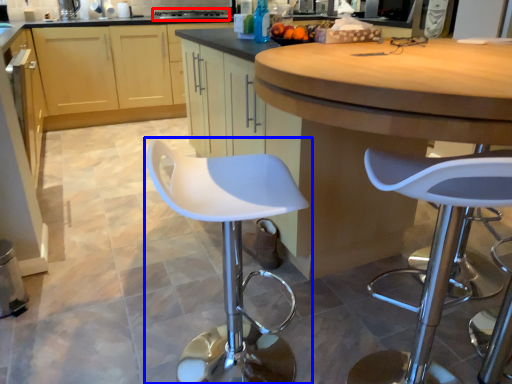
Question: Which of the following is the farthest to the observer, stove (highlighted by a red box) or chair (highlighted by a blue box)?

Choices:
 (A) stove
 (B) chair

Answer: (A)